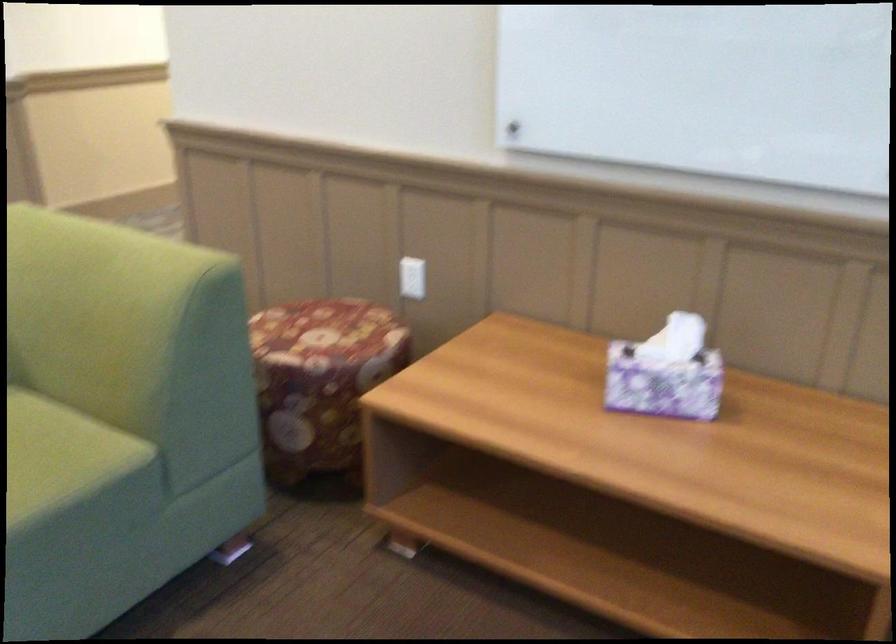
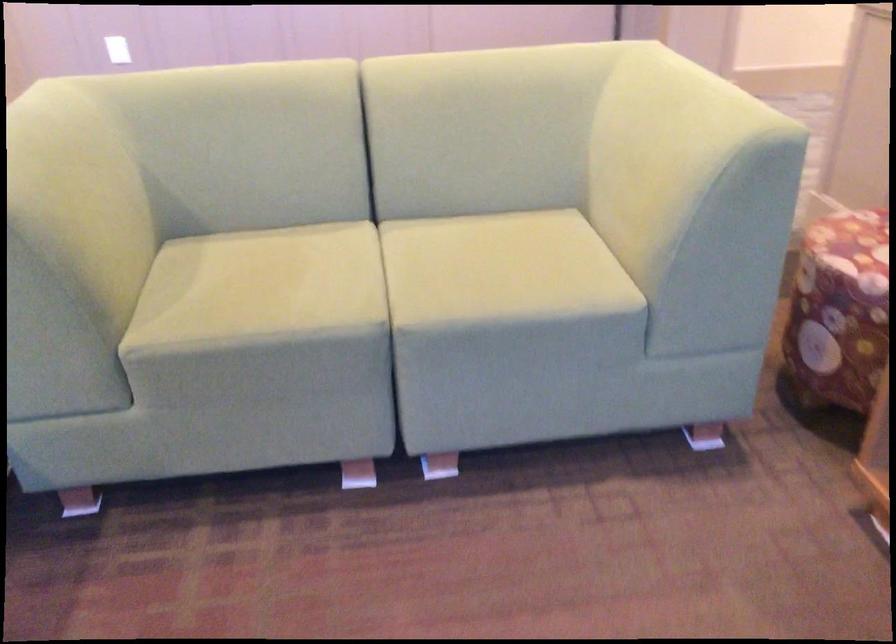
Where in the second image is the point corresponding to point 276,332 from the first image?

(851, 231)